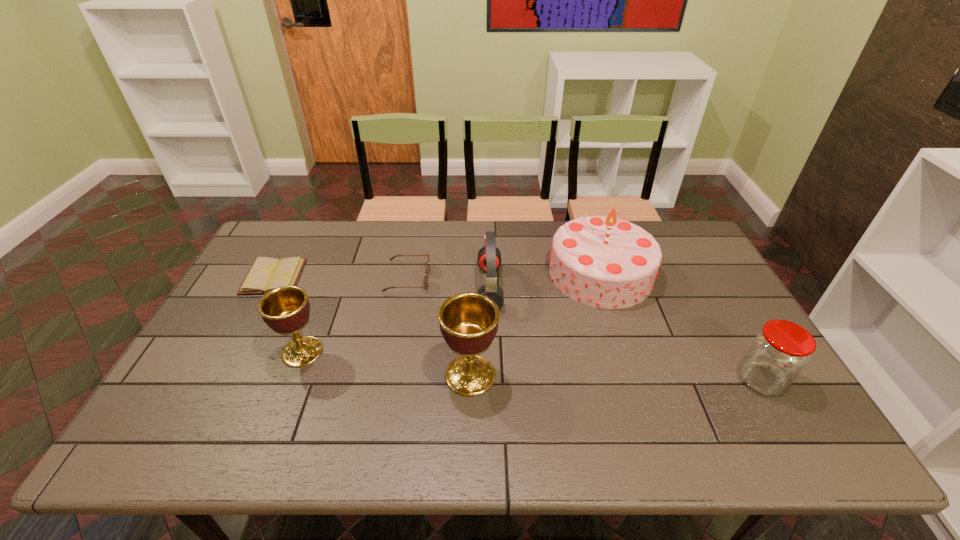
This screenshot has width=960, height=540. In the image, there is a desktop. Identify the location of vacant space at the far left corner. (266, 247).

You are a GUI agent. You are given a task and a screenshot of the screen. Output one action in this format:
    pyautogui.click(x=<x>, y=<y>)
    Task: Click on the vacant space at the near left corner of the desktop
    This screenshot has width=960, height=540.
    Given the screenshot: What is the action you would take?
    pyautogui.click(x=182, y=413)

Where is `vacant region at the far right corner of the desktop`? The image size is (960, 540). vacant region at the far right corner of the desktop is located at coordinates (700, 252).

Find the location of `vacant area between the birthday cake and the third object from left to right`. vacant area between the birthday cake and the third object from left to right is located at coordinates (504, 276).

Identify the location of vacant area that lies between the birthday cake and the third object from left to right. (504, 276).

I want to click on empty space that is in between the left chalice and the earphone, so pos(396,320).

This screenshot has height=540, width=960. In order to click on free space between the right chalice and the shorter chalice in this screenshot , I will do `click(386, 363)`.

Find the location of a particular element. The width and height of the screenshot is (960, 540). empty location between the sixth object from left to right and the sixth tallest object is located at coordinates (504, 276).

The image size is (960, 540). I want to click on empty space that is in between the jar and the earphone, so click(625, 334).

Image resolution: width=960 pixels, height=540 pixels. I want to click on free space between the shorter chalice and the rightmost object, so click(x=532, y=366).